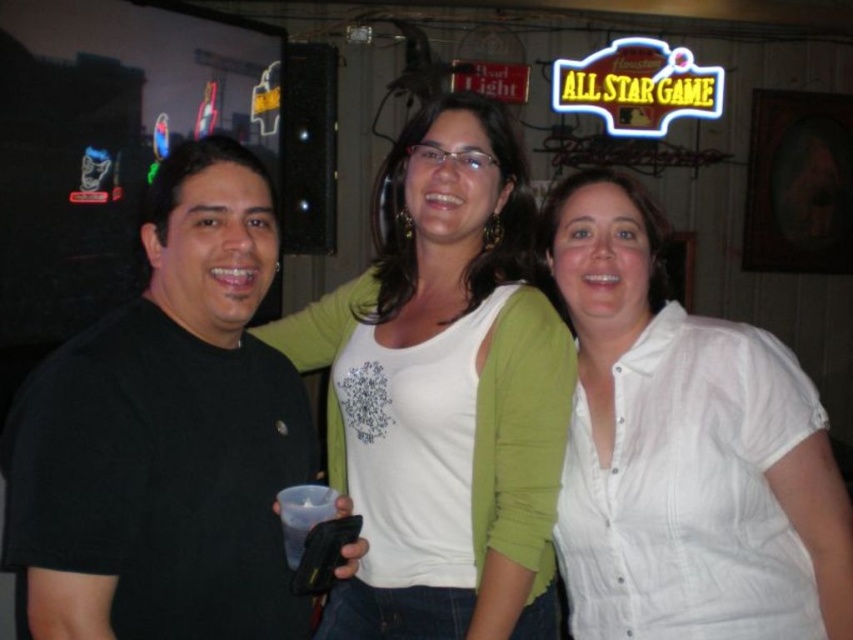
Question: Can you confirm if white cotton shirt at center is bigger than white matte shirt at center?

Choices:
 (A) no
 (B) yes

Answer: (A)

Question: Does white cotton shirt at center appear over white matte shirt at center?

Choices:
 (A) no
 (B) yes

Answer: (A)

Question: Which point is farther to the camera?

Choices:
 (A) black matte shirt at left
 (B) white cotton shirt at center

Answer: (B)

Question: Among these objects, which one is nearest to the camera?

Choices:
 (A) black matte shirt at left
 (B) white matte shirt at center

Answer: (A)

Question: Which point is farther to the camera?

Choices:
 (A) white cotton shirt at center
 (B) white matte shirt at center
 (C) black matte shirt at left

Answer: (B)

Question: Does white cotton shirt at center have a lesser width compared to white matte shirt at center?

Choices:
 (A) yes
 (B) no

Answer: (A)